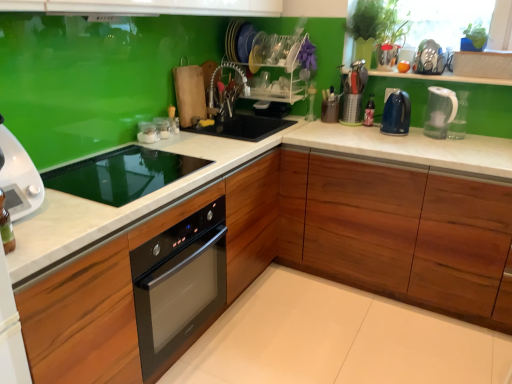
Find the location of a particular element. Image resolution: width=512 pixels, height=384 pixels. vacant space to the right of transparent plastic kettle at right, the 2th kitchen appliance positioned from the left is located at coordinates (476, 139).